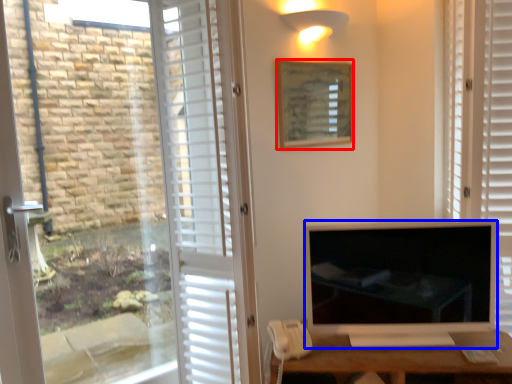
Question: Among these objects, which one is farthest to the camera, picture frame (highlighted by a red box) or television (highlighted by a blue box)?

Choices:
 (A) picture frame
 (B) television

Answer: (A)